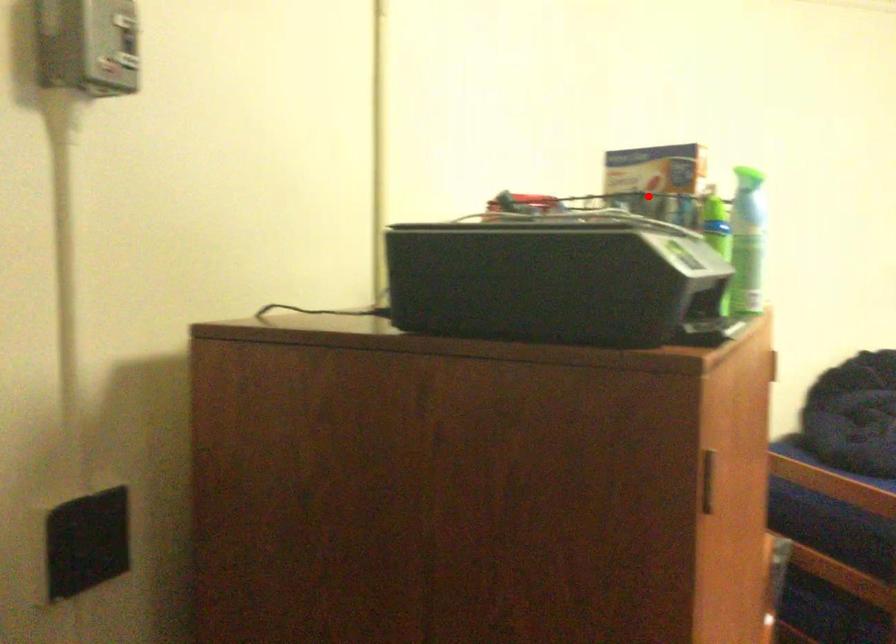
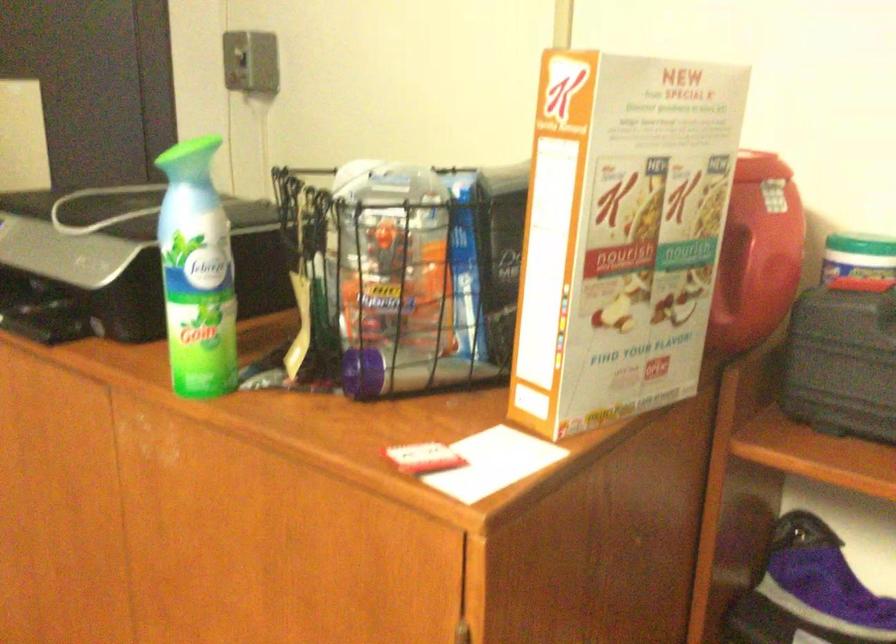
In the second image, find the point that corresponds to the highlighted location in the first image.

(640, 228)